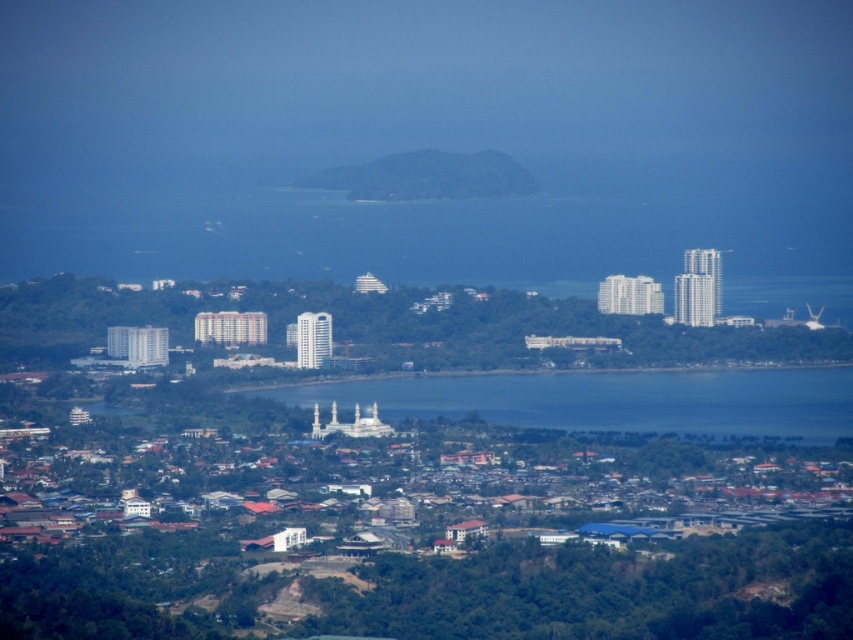
You are a drone operator tasked with capturing aerial footage of the coastal urban area. Your drone has a maximum flight range of 50 meters. If you are positioned at the green textured hill at center, can you fly your drone to the blue water at center without exceeding its range?

The distance between the green textured hill at center and blue water at center is 51.65 meters, which exceeds the drone maximum flight range of 50 meters. Therefore, the drone cannot reach the blue water at center from the green textured hill at center without exceeding its range.

You are standing at the vantage point overlooking the coastal urban area. You notice two points marked in the image. Which point, point [811,372] or point [525,180], is closer to your current position?

Point [525,180] is closer to your current position because it is less further to the viewer than point [811,372] according to the description.

You are a city planner reviewing this coastal urban area. You need to decide where to place a new public park. Considering the blue water at center and the green textured hill at center, which location would allow for a larger park area?

The blue water at center has a larger size compared to the green textured hill at center, so placing the new public park on the blue water at center would allow for a larger park area.